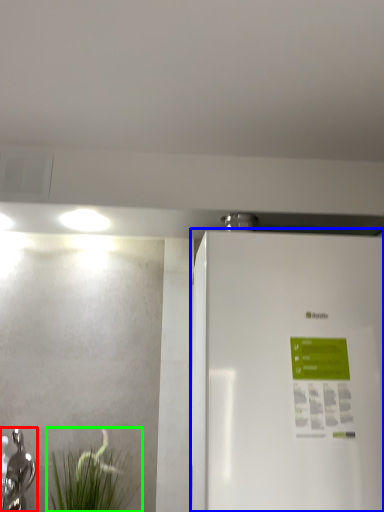
Question: Considering the real-world distances, which object is farthest from tap (highlighted by a red box)? refrigerator (highlighted by a blue box) or plant (highlighted by a green box)?

Choices:
 (A) refrigerator
 (B) plant

Answer: (A)